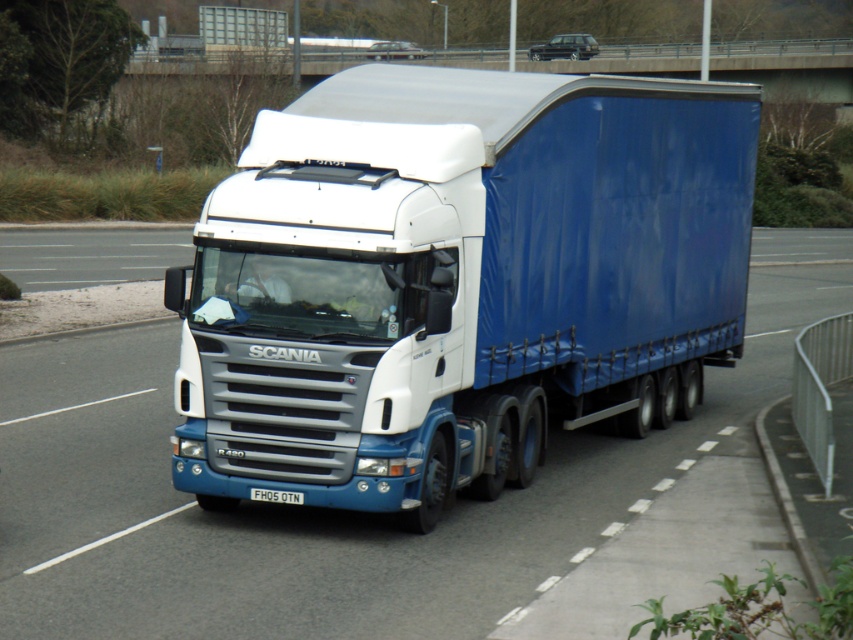
Question: Does white matte truck at center appear on the left side of white plastic license plate at center?

Choices:
 (A) no
 (B) yes

Answer: (A)

Question: Which of the following is the closest to the observer?

Choices:
 (A) (451, 394)
 (B) (277, 499)

Answer: (B)

Question: Which object is the closest to the white plastic license plate at center?

Choices:
 (A) white matte truck at center
 (B) blue fabric truck at center

Answer: (A)

Question: Among these points, which one is nearest to the camera?

Choices:
 (A) (474, 176)
 (B) (111, 429)
 (C) (262, 490)

Answer: (C)

Question: Does white matte truck at center appear under blue fabric truck at center?

Choices:
 (A) no
 (B) yes

Answer: (B)

Question: Does blue fabric truck at center appear on the right side of white plastic license plate at center?

Choices:
 (A) no
 (B) yes

Answer: (B)